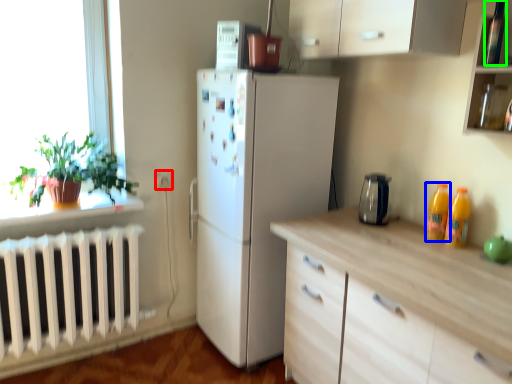
Question: Estimate the real-world distances between objects in this image. Which object is farther from electric outlet (highlighted by a red box), bottle (highlighted by a blue box) or bottle (highlighted by a green box)?

Choices:
 (A) bottle
 (B) bottle

Answer: (B)